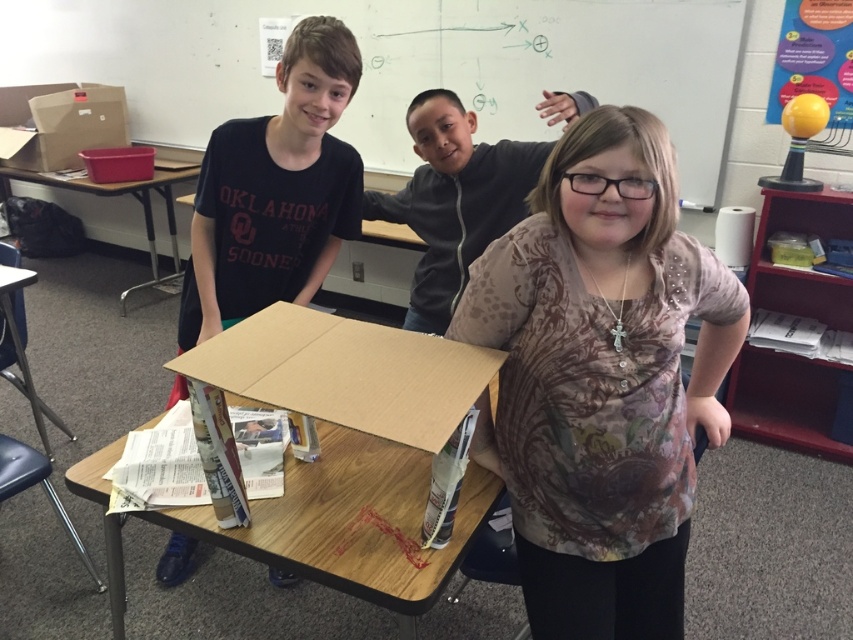
Question: Is black matte shirt at center further to camera compared to wooden table at left?

Choices:
 (A) yes
 (B) no

Answer: (B)

Question: Which object is closer to the camera taking this photo?

Choices:
 (A) wooden table at left
 (B) whiteboard at upper center
 (C) dark gray zip-up hoodie at center
 (D) black matte shirt at center

Answer: (D)

Question: Which of these objects is positioned farthest from the wooden table at center?

Choices:
 (A) black matte shirt at center
 (B) brown cardboard box at upper left
 (C) whiteboard at upper center

Answer: (B)

Question: Which of the following is the farthest from the observer?

Choices:
 (A) brown printed shirt at center
 (B) wooden table at left

Answer: (B)

Question: Is whiteboard at upper center wider than dark gray zip-up hoodie at center?

Choices:
 (A) yes
 (B) no

Answer: (A)

Question: Where is black matte shirt at center located in relation to wooden table at left in the image?

Choices:
 (A) right
 (B) left

Answer: (A)